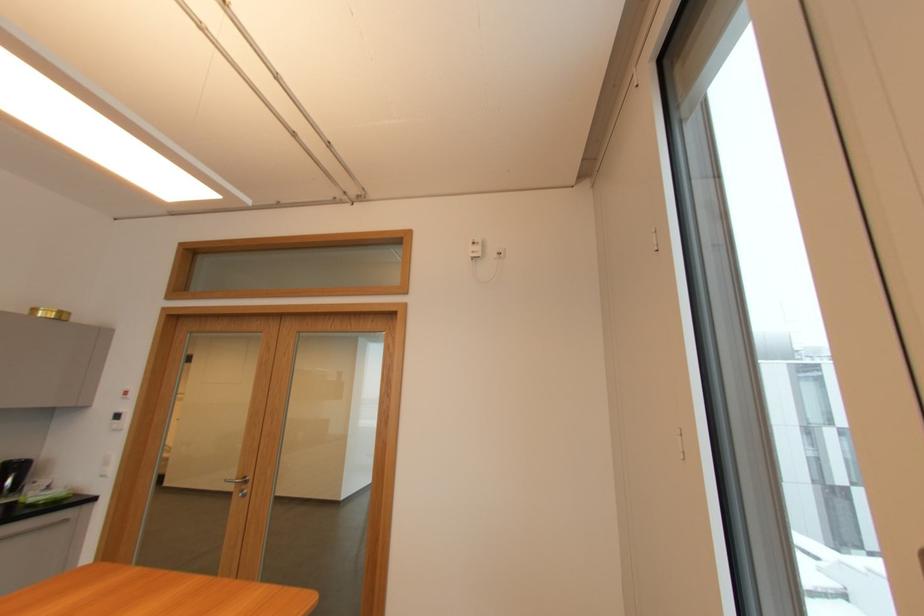
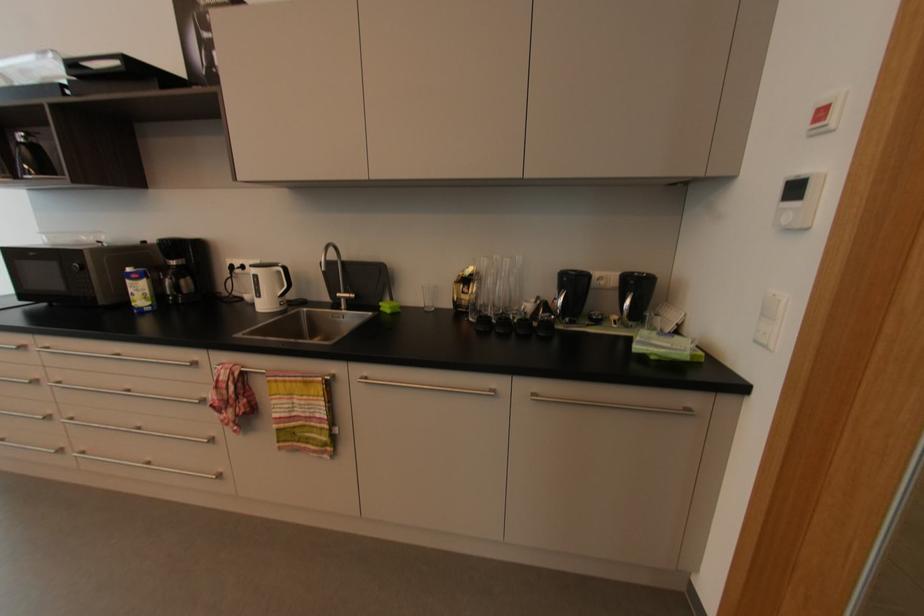
Where in the second image is the point corresponding to (x=45, y=501) from the first image?

(657, 358)